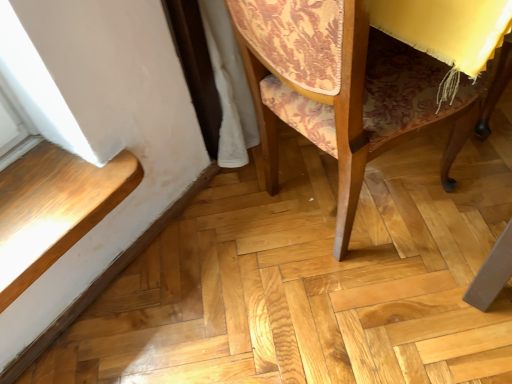
Find the location of a particular element. unoccupied area in front of patterned fabric chair at center is located at coordinates (357, 325).